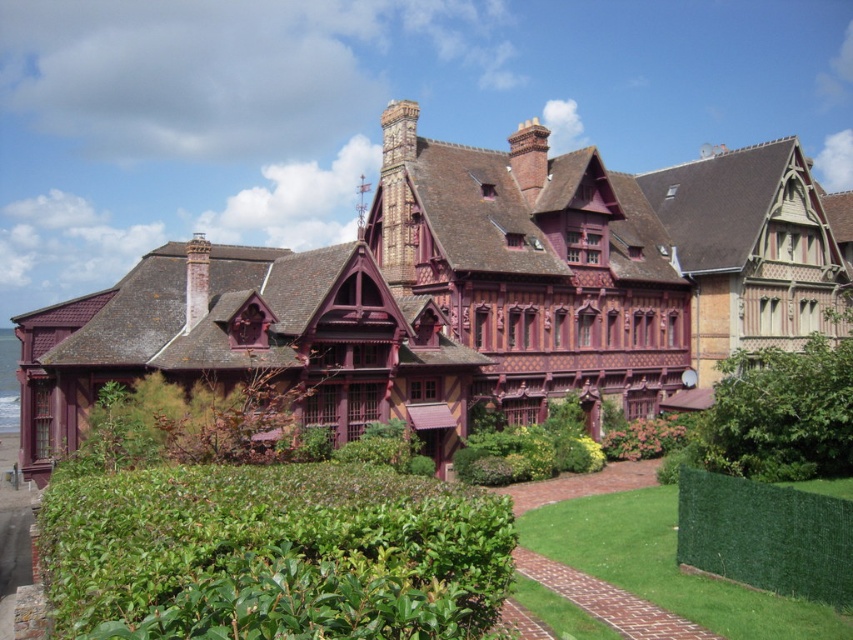
You are standing in front of the historic building and want to walk from the green artificial hedge at lower right to the green leafy hedge at center right. Which direction should you move to reach it?

You should move to the right to reach the green leafy hedge at center right since it is located to the right of the green artificial hedge at lower right.

You are planning to plant a new tree in the garden of the historic building. The tree you want to plant grows to a height of 3 meters. The green leafy hedge at center right is currently 2.5 meters tall, and the green artificial hedge at lower right is 1.8 meters tall. Will the new tree exceed the height of both hedges when fully grown?

The green leafy hedge at center right is taller than the green artificial hedge at lower right. The new tree will grow to 3 meters, which is taller than both hedges since the tallest hedge is 2.5 meters. Therefore, the new tree will exceed the height of both hedges when fully grown.